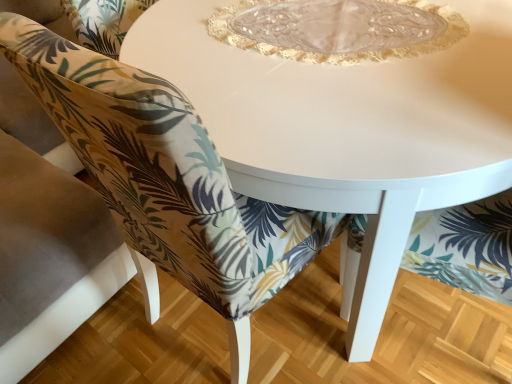
This screenshot has height=384, width=512. Identify the location of unoccupied area in front of transparent glass plate at center. (354, 115).